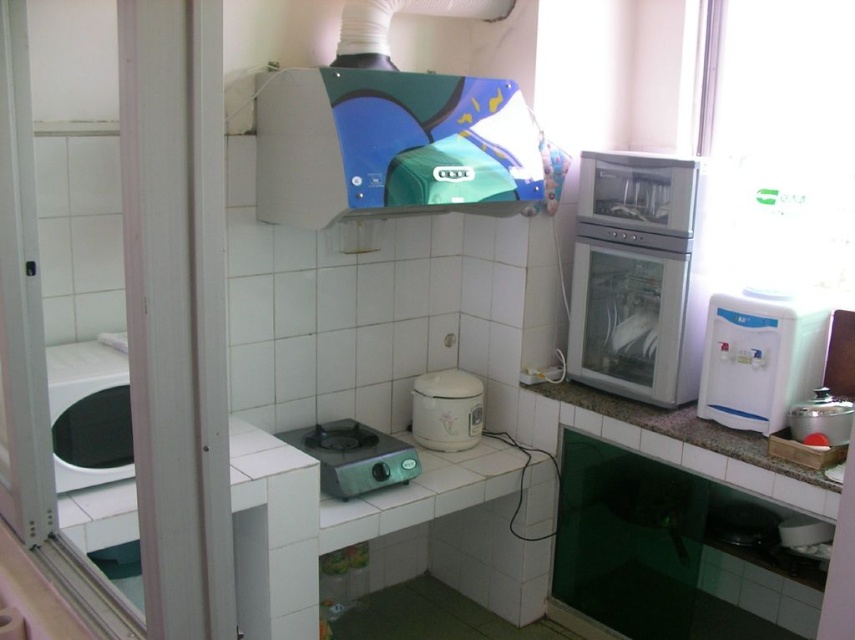
Is point (612, 397) more distant than point (325, 438)?

That is True.

Is white glossy countertop at right further to the viewer compared to green matte electric stove at center?

That is False.

Between point (814, 484) and point (376, 483), which one is positioned behind?

Point (376, 483)

In order to click on white glossy countertop at right in this screenshot , I will do `click(681, 428)`.

Between point (352, 176) and point (394, 476), which one is positioned in front?

Point (352, 176) is in front.

What do you see at coordinates (390, 145) in the screenshot? The image size is (855, 640). I see `blue glossy exhaust hood at upper center` at bounding box center [390, 145].

Is point (398, 140) less distant than point (399, 449)?

Yes, it is in front of point (399, 449).

Image resolution: width=855 pixels, height=640 pixels. What are the coordinates of `blue glossy exhaust hood at upper center` in the screenshot? It's located at (390, 145).

From the picture: Who is positioned more to the left, white glossy countertop at right or white matte rice cooker at center?

white matte rice cooker at center is more to the left.

Which is more to the right, white glossy countertop at right or white matte rice cooker at center?

From the viewer's perspective, white glossy countertop at right appears more on the right side.

Does point (612, 410) come closer to viewer compared to point (441, 394)?

Yes, point (612, 410) is in front of point (441, 394).

I want to click on white glossy countertop at right, so click(681, 428).